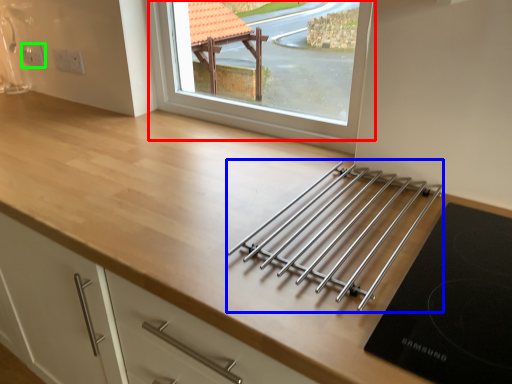
Question: Considering the real-world distances, which object is closest to window (highlighted by a red box)? wide (highlighted by a blue box) or electric outlet (highlighted by a green box).

Choices:
 (A) wide
 (B) electric outlet

Answer: (A)